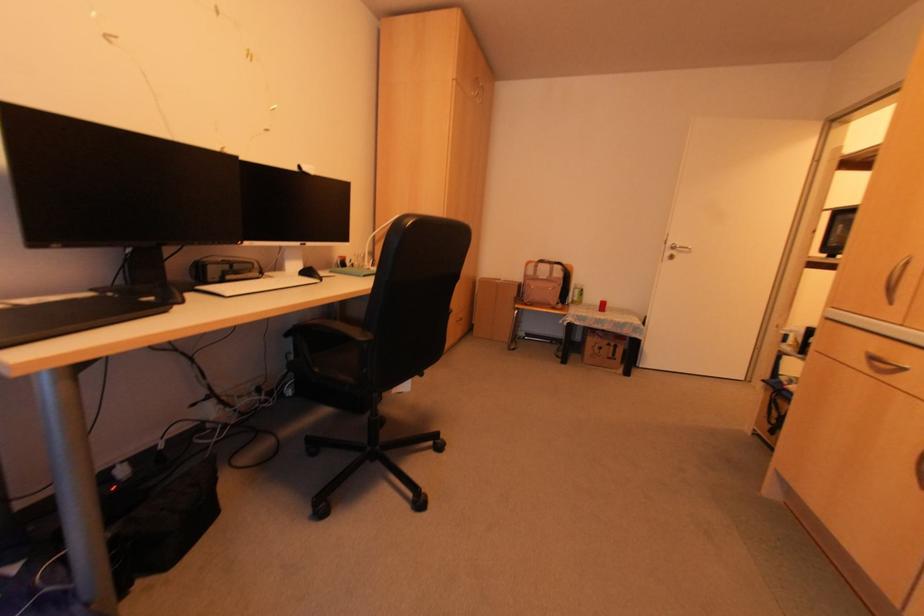
Find where to pull the silver cabinet handle. Please return your answer as a coordinate pair (x, y).

(895, 278)